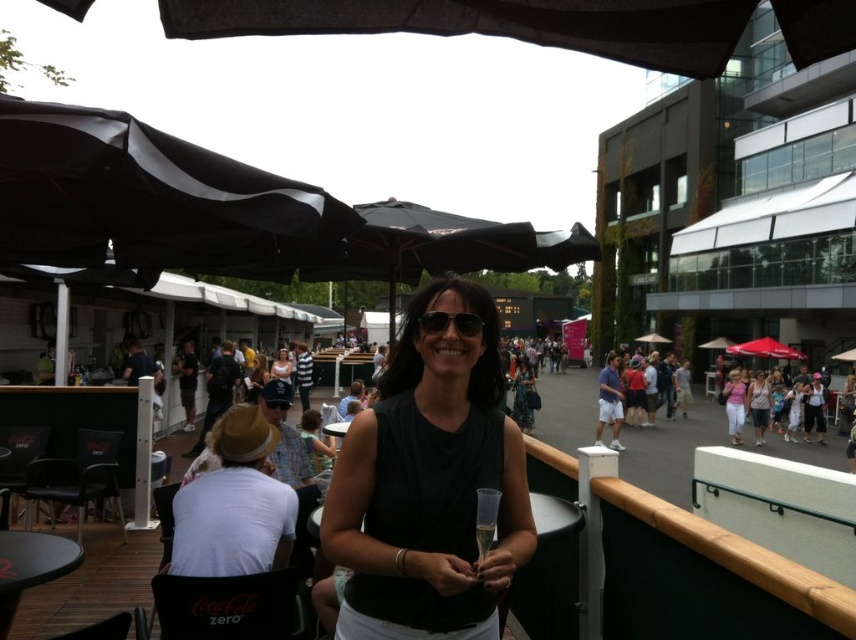
You are a photographer at the event and want to capture a closeup shot of the black plastic sunglasses at center without including the black matte dress at center in the frame. Given their sizes, do you think this is possible?

The black matte dress at center is wider than the black plastic sunglasses at center, so it is possible to frame the shot to exclude the dress by focusing tightly on the sunglasses.

You are at a social event and see a woman in a black matte dress at center and a red fabric umbrella at center. Which object is positioned to the left of the other?

The black matte dress at center is to the left of the red fabric umbrella at center.

You are a caterer at an event and need to move a tray of drinks from the black matte umbrella at upper left to the red fabric umbrella at center. The tray is 3 feet wide. Is there enough space between the two umbrellas to move the tray without tilting it?

The distance between the black matte umbrella at upper left and red fabric umbrella at center is 72.45 feet, which is more than enough space to move the 3 feet wide tray without tilting it.